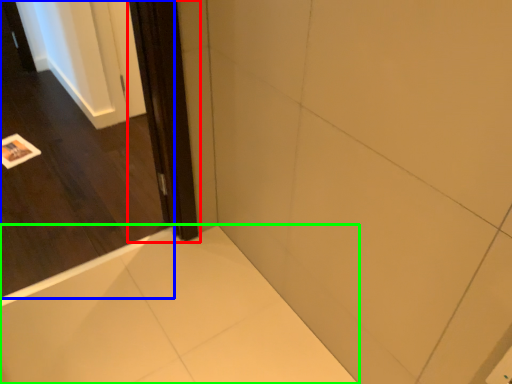
Question: Based on their relative distances, which object is nearer to screen door (highlighted by a red box)? Choose from door (highlighted by a blue box) and bath (highlighted by a green box).

Choices:
 (A) door
 (B) bath

Answer: (B)